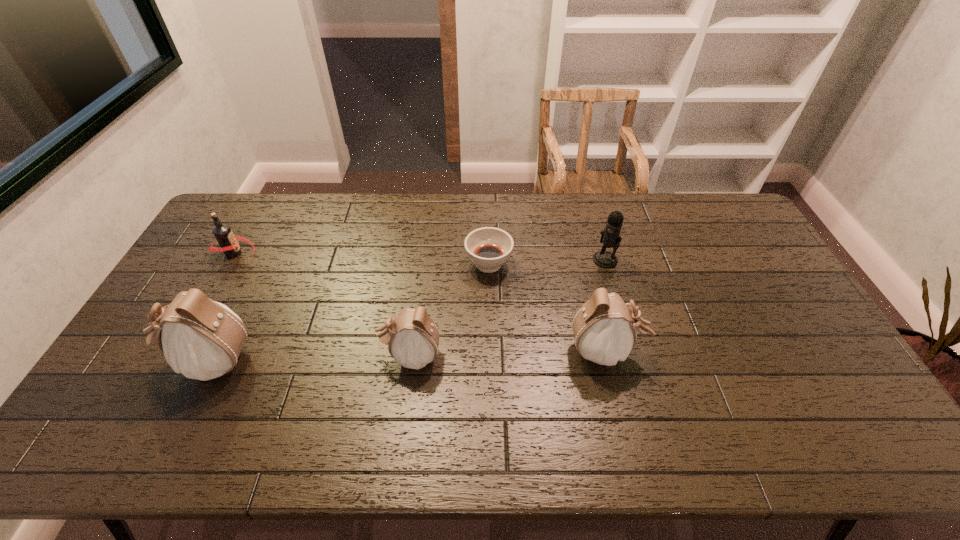
Where is `free space between the second pouch from right to left and the fourth object from left to right`? free space between the second pouch from right to left and the fourth object from left to right is located at coordinates (449, 310).

Identify the location of vacant area that lies between the leftmost pouch and the second pouch from right to left. Image resolution: width=960 pixels, height=540 pixels. (310, 358).

Identify the location of free space between the shortest object and the rightmost pouch. (547, 307).

The height and width of the screenshot is (540, 960). In order to click on blank region between the soup bowl and the microphone in this screenshot , I will do `click(547, 261)`.

Identify the location of free point between the soup bowl and the root beer. (362, 259).

This screenshot has height=540, width=960. I want to click on free area in between the rightmost pouch and the root beer, so click(420, 302).

The width and height of the screenshot is (960, 540). What are the coordinates of `object that ranks as the second closest to the microphone` in the screenshot? It's located at (488, 248).

Find the location of a particular element. Image resolution: width=960 pixels, height=540 pixels. object that can be found as the second closest to the root beer is located at coordinates (412, 337).

The width and height of the screenshot is (960, 540). I want to click on pouch that is the second closest to the rightmost pouch, so pos(202,339).

Point out which pouch is positioned as the third nearest to the root beer. Please provide its 2D coordinates. Your answer should be formatted as a tuple, i.e. [(x, y)], where the tuple contains the x and y coordinates of a point satisfying the conditions above.

[(604, 330)]